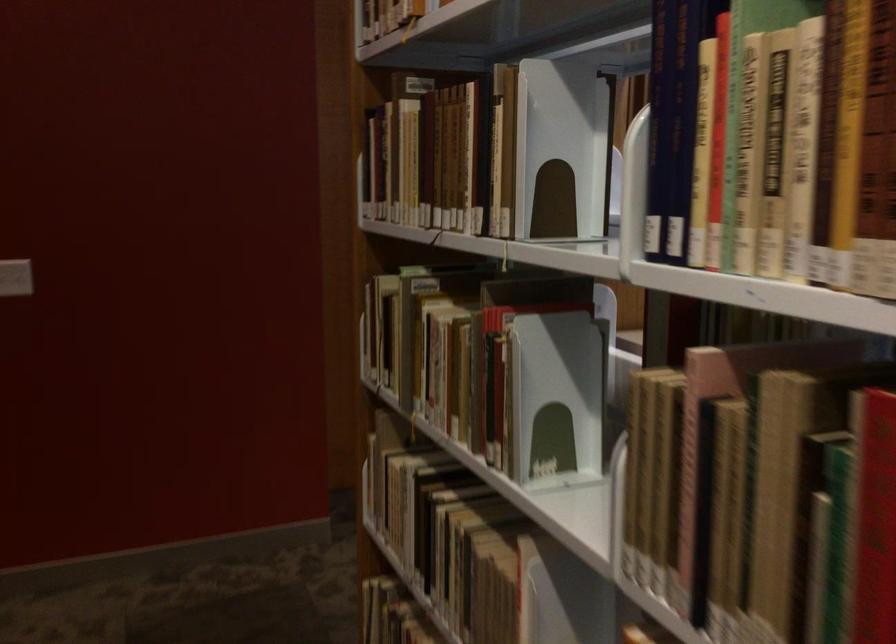
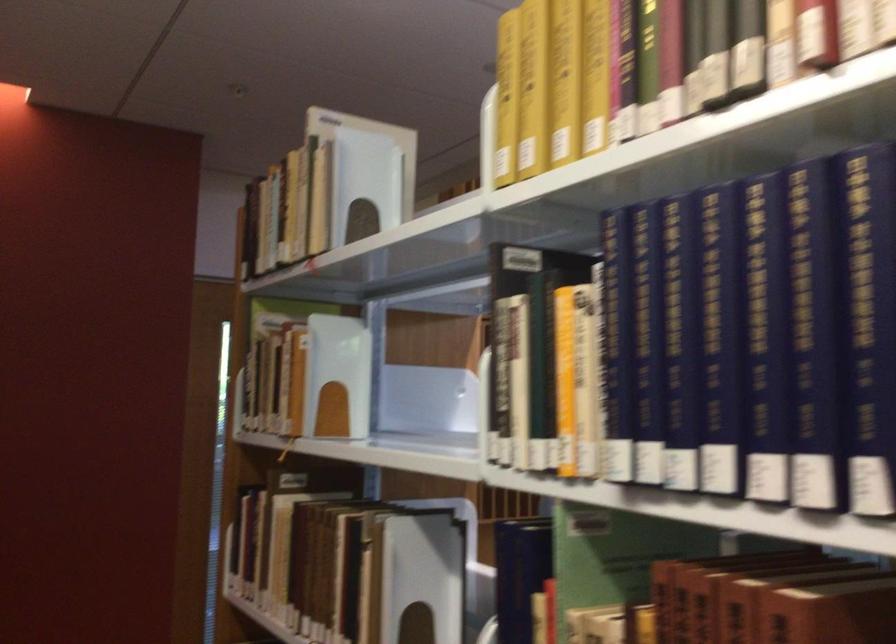
Question: The images are taken continuously from a first-person perspective. In which direction is your viewpoint rotating?

Choices:
 (A) Left
 (B) Right
 (C) Up
 (D) Down

Answer: (C)